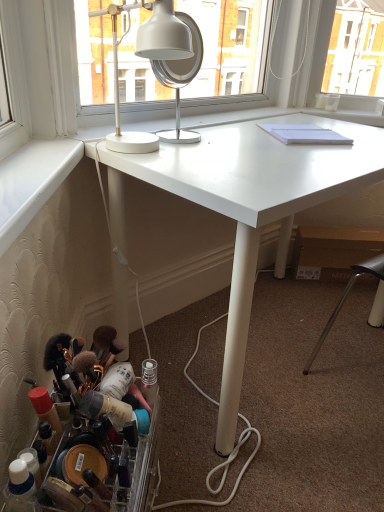
You are a GUI agent. You are given a task and a screenshot of the screen. Output one action in this format:
    pyautogui.click(x=<x>, y=<y>)
    Task: Click on the empty space that is to the right of white metallic mirror at upper center
    This screenshot has width=384, height=512.
    Given the screenshot: What is the action you would take?
    pyautogui.click(x=231, y=143)